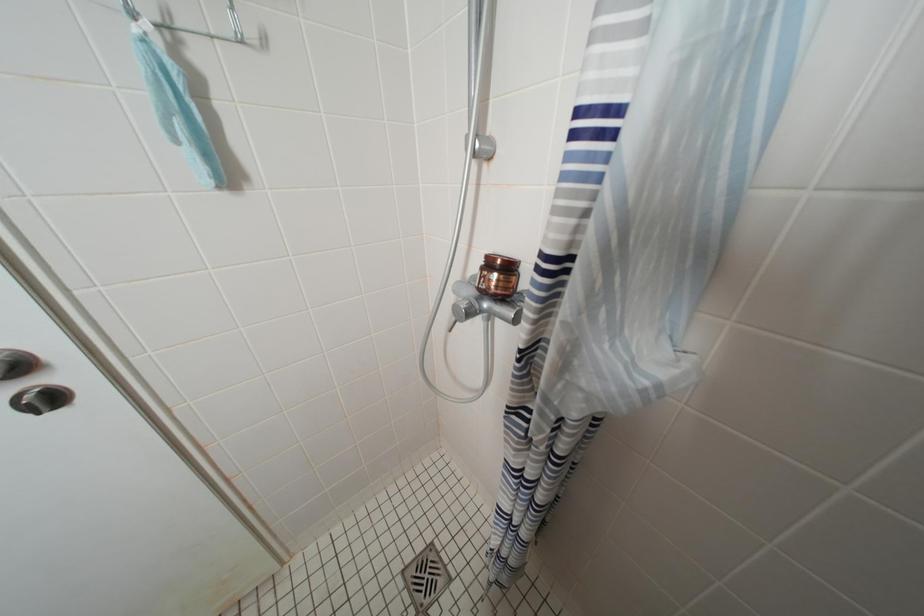
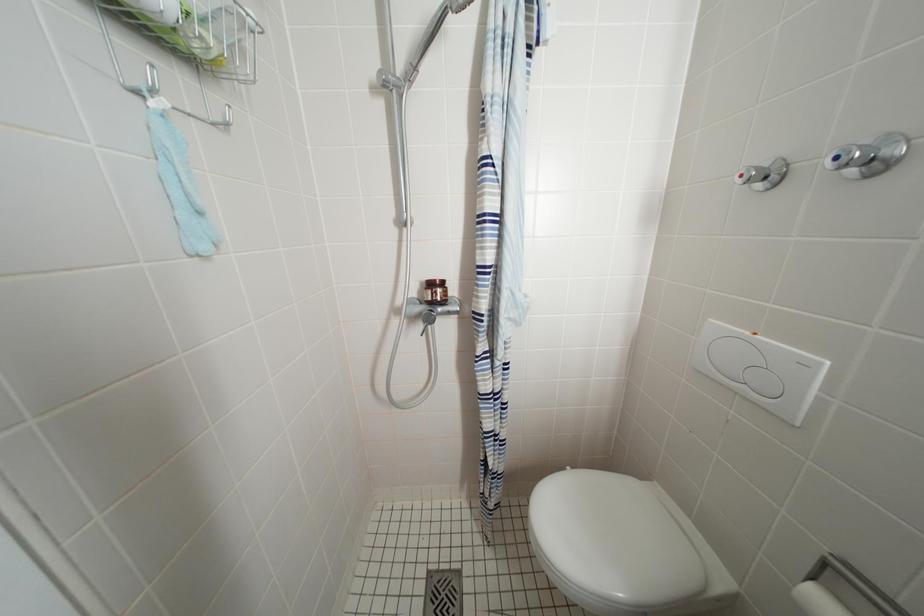
Question: The images are taken continuously from a first-person perspective. In which direction is your viewpoint rotating?

Choices:
 (A) Left
 (B) Right
 (C) Up
 (D) Down

Answer: (B)